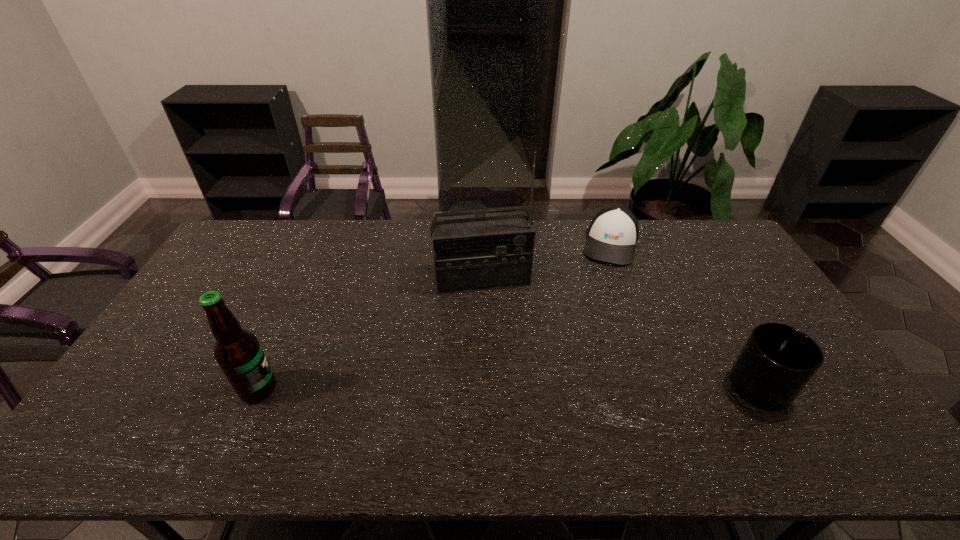
This screenshot has width=960, height=540. Find the location of `vacant space that satisfies the following two spatial constraints: 1. on the front side of the mug; 2. with the handle on the side of the third object from right to left`. vacant space that satisfies the following two spatial constraints: 1. on the front side of the mug; 2. with the handle on the side of the third object from right to left is located at coordinates (483, 387).

Locate an element on the screen. free space that satisfies the following two spatial constraints: 1. on the front side of the third object from right to left; 2. with the handle on the side of the mug is located at coordinates (483, 387).

Locate an element on the screen. Image resolution: width=960 pixels, height=540 pixels. vacant space that satisfies the following two spatial constraints: 1. on the front side of the shortest object; 2. with the handle on the side of the mug is located at coordinates (662, 387).